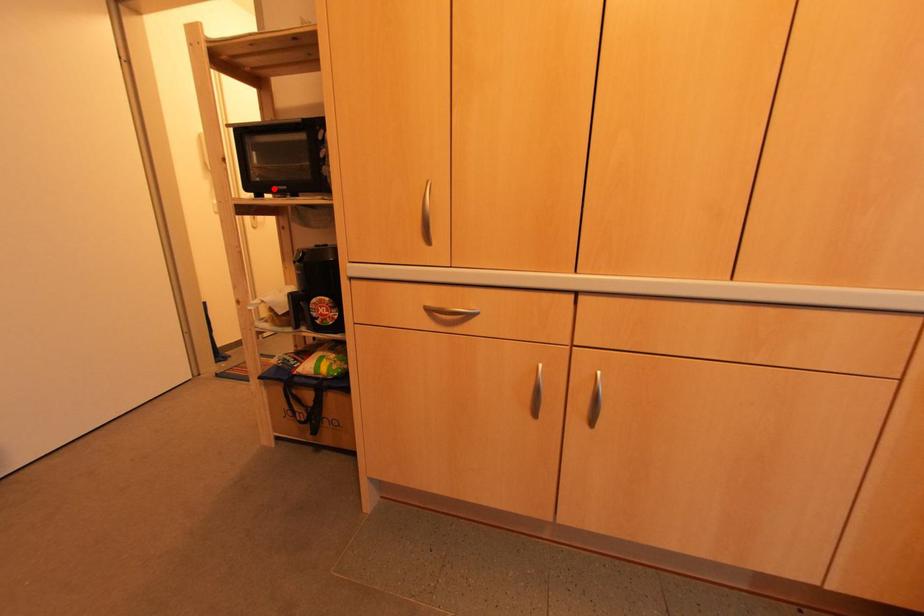
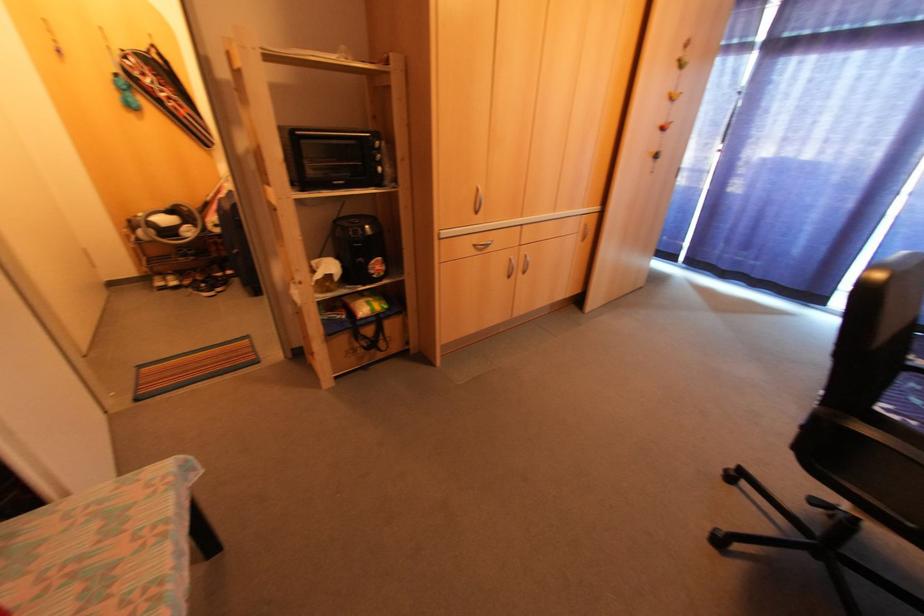
Find the pixel in the second image that matches the highlighted location in the first image.

(334, 184)